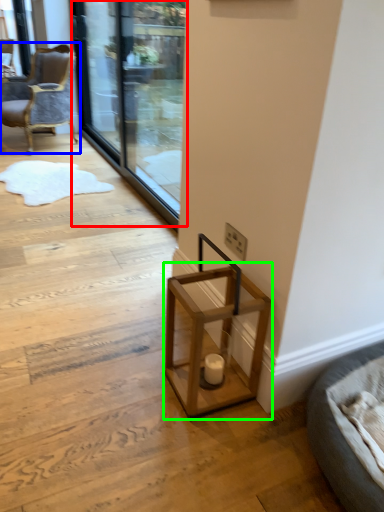
Question: Which is nearer to the screen door (highlighted by a red box)? chair (highlighted by a blue box) or table (highlighted by a green box).

Choices:
 (A) chair
 (B) table

Answer: (A)